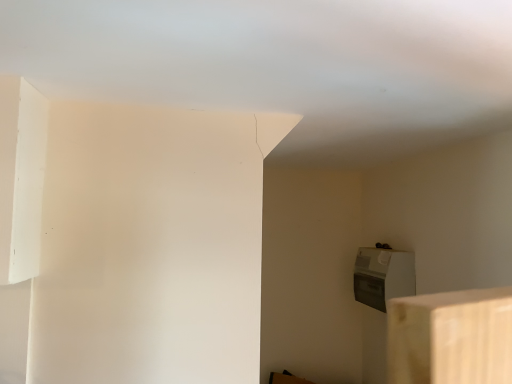
Question: Should I look upward or downward to see satin silver appliance at lower right?

Choices:
 (A) up
 (B) down

Answer: (B)